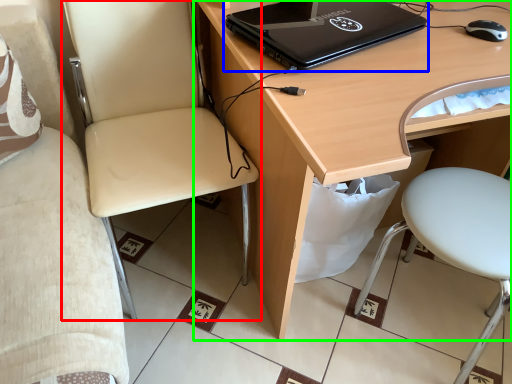
Question: Which object is positioned farthest from chair (highlighted by a red box)? Select from laptop (highlighted by a blue box) and desk (highlighted by a green box).

Choices:
 (A) laptop
 (B) desk

Answer: (A)